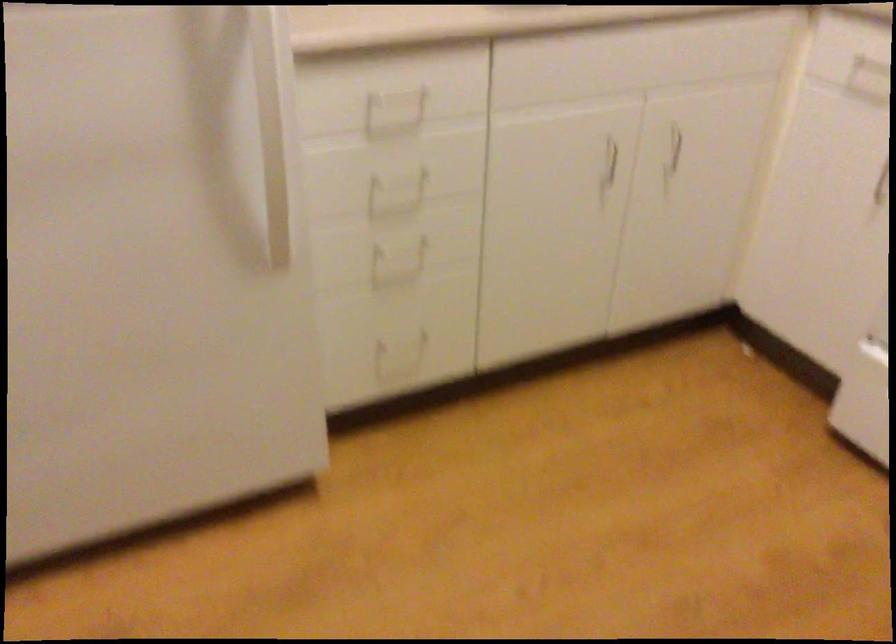
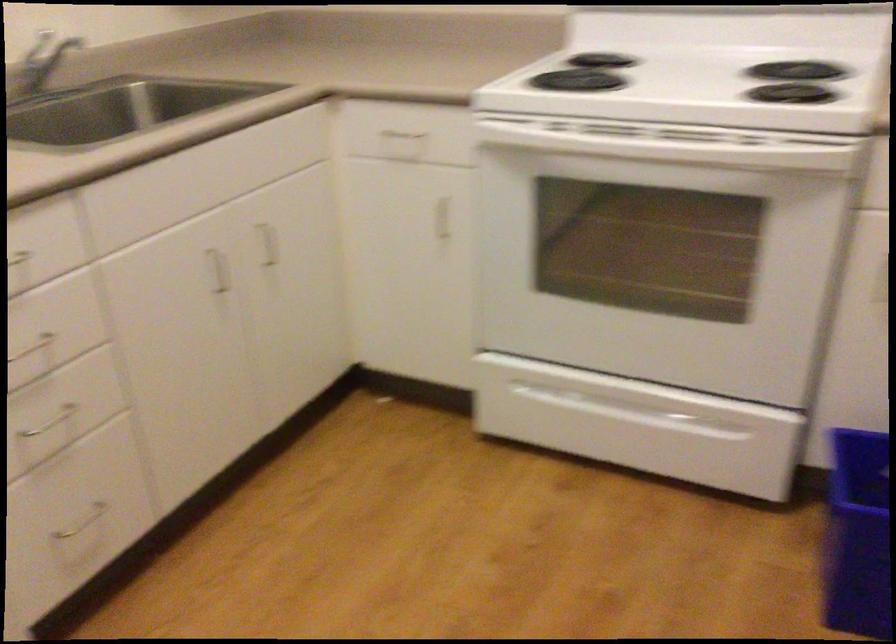
Question: The camera is either moving clockwise (left) or counter-clockwise (right) around the object. The first image is from the beginning of the video and the second image is from the end. Is the camera moving left or right when shooting the video?

Choices:
 (A) Left
 (B) Right

Answer: (A)